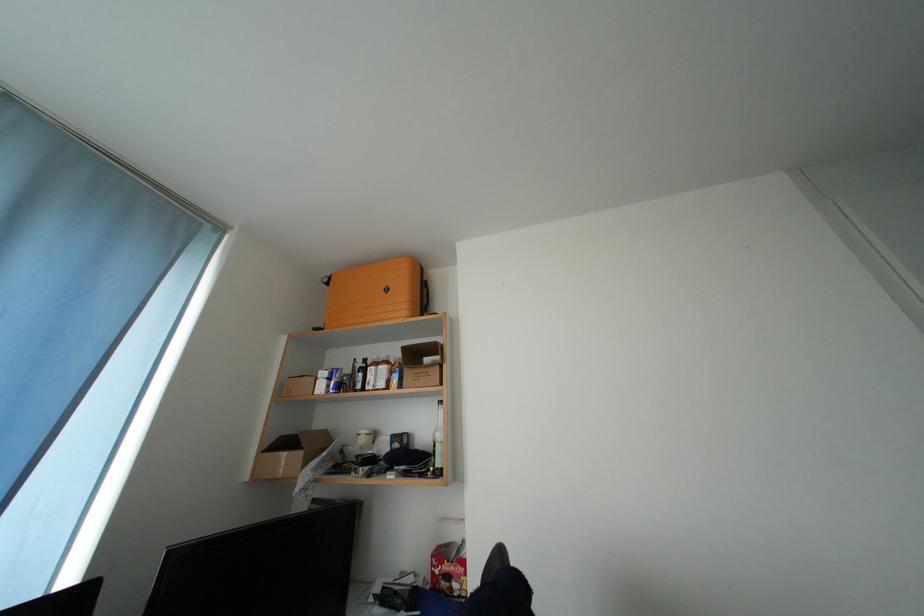
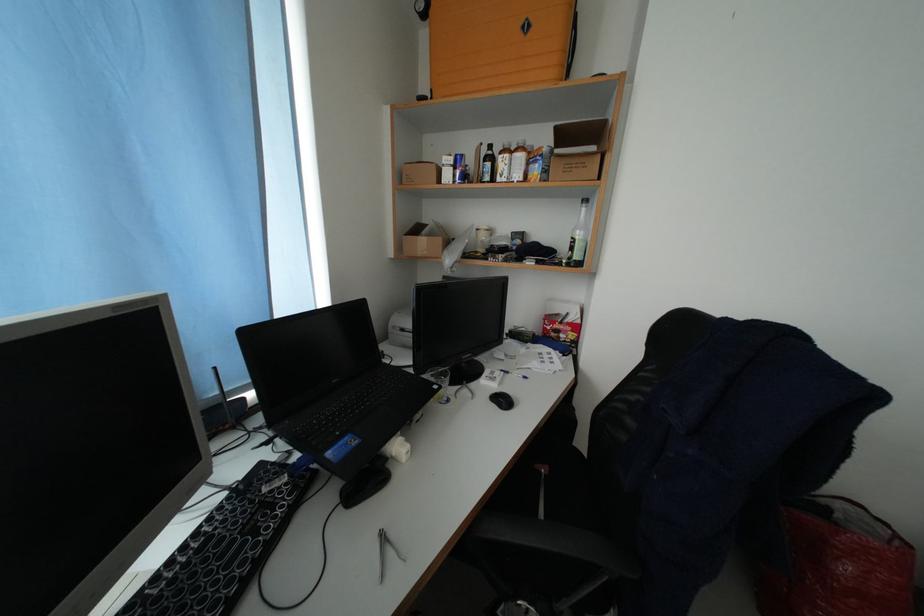
Locate, in the second image, the point that corresponds to (417,379) in the first image.

(563, 169)